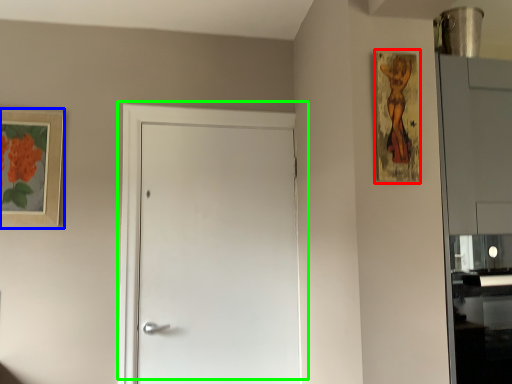
Question: Considering the real-world distances, which object is farthest from picture frame (highlighted by a red box)? picture frame (highlighted by a blue box) or door (highlighted by a green box)?

Choices:
 (A) picture frame
 (B) door

Answer: (A)